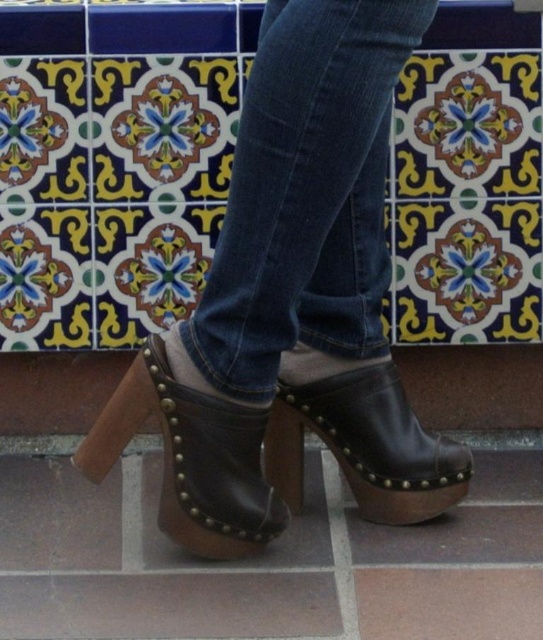
Question: Is denim at center positioned behind leather clog at lower center?

Choices:
 (A) yes
 (B) no

Answer: (B)

Question: Among these points, which one is farthest from the camera?

Choices:
 (A) (294, 124)
 (B) (331, 390)

Answer: (B)

Question: Which point is closer to the camera?

Choices:
 (A) (375, 289)
 (B) (337, 456)
 (C) (223, 428)

Answer: (C)

Question: Is brown leather clogs at center below brown wooden tile at lower center?

Choices:
 (A) yes
 (B) no

Answer: (B)

Question: Among these objects, which one is farthest from the camera?

Choices:
 (A) denim at center
 (B) brown leather clog at center

Answer: (B)

Question: Does leather clog at lower center have a lesser width compared to brown wooden tile at lower center?

Choices:
 (A) yes
 (B) no

Answer: (B)